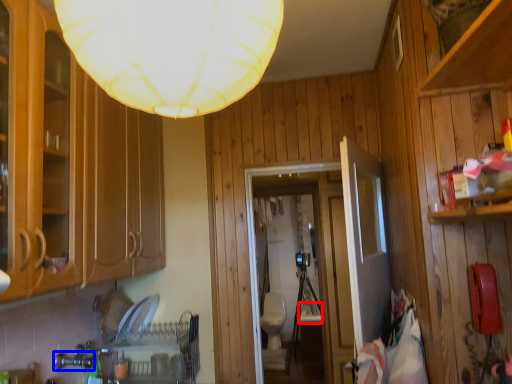
Question: Which point is closer to the camera, sink (highlighted by a red box) or faucet (highlighted by a blue box)?

Choices:
 (A) sink
 (B) faucet

Answer: (B)